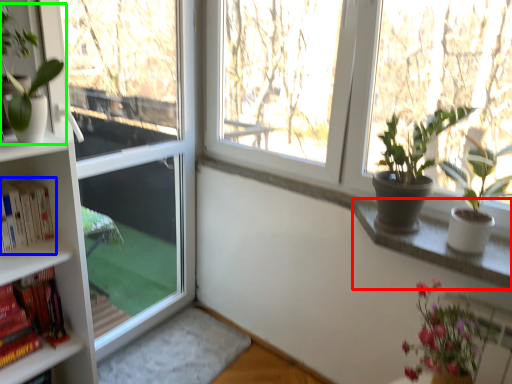
Question: Which object is the farthest from window sill (highlighted by a red box)? Choose among these: book (highlighted by a blue box) or houseplant (highlighted by a green box).

Choices:
 (A) book
 (B) houseplant

Answer: (B)